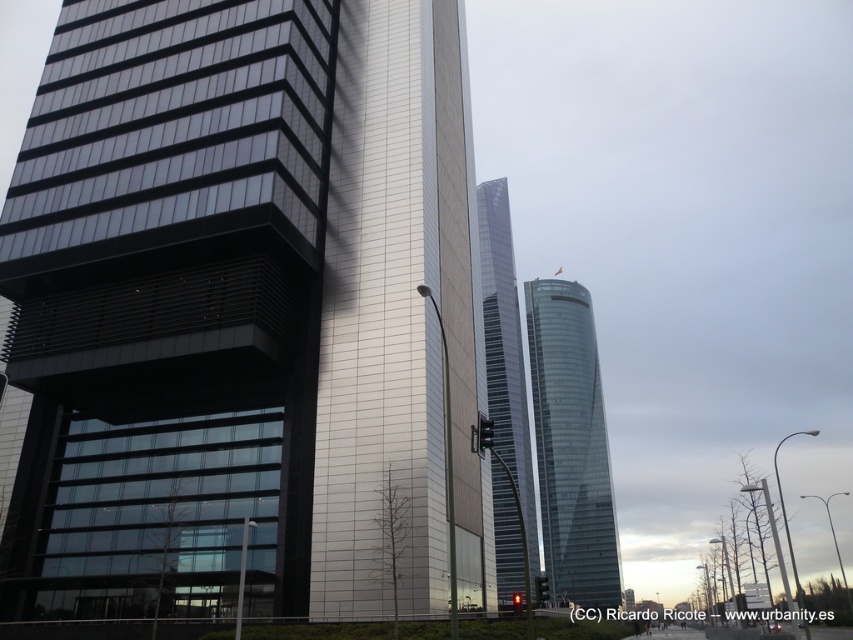
You are an architect evaluating the urban skyline. You notice the glassy steel building at center and the transparent glass tower at center. Which of these two buildings is smaller in size?

The glassy steel building at center has a smaller size compared to the transparent glass tower at center, so the glassy steel building at center is the smaller one.

You are standing in the middle of the city square and see the glassy steel building at center and the transparent glass tower at center. Which one is positioned more to the left?

The glassy steel building at center is positioned more to the left than the transparent glass tower at center.